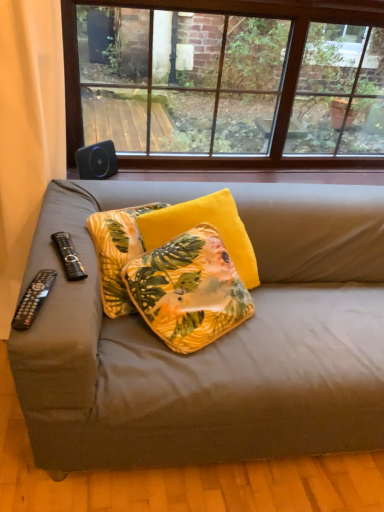
Image resolution: width=384 pixels, height=512 pixels. I want to click on free space to the back side of black plastic remote at lower left, the 1th remote control when ordered from bottom to top, so click(54, 268).